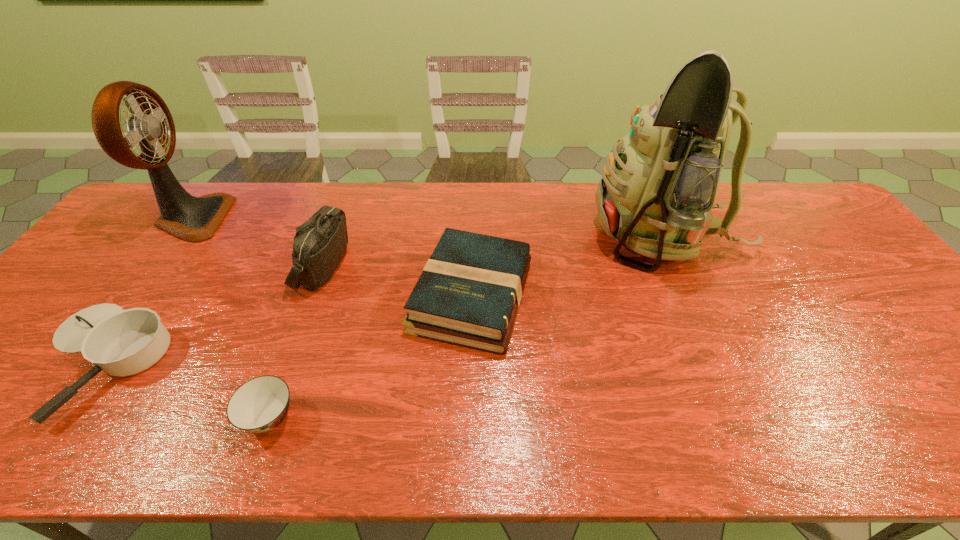
Where is `free region at the near edge of the desktop`? Image resolution: width=960 pixels, height=540 pixels. free region at the near edge of the desktop is located at coordinates (797, 429).

I want to click on vacant space at the left edge of the desktop, so (x=108, y=245).

Locate an element on the screen. This screenshot has width=960, height=540. vacant space at the right edge of the desktop is located at coordinates (843, 288).

Find the location of a particular element. free area in between the soup bowl and the shoulder bag is located at coordinates (297, 341).

Where is `free space that is in between the fifth shortest object and the shoulder bag`? The height and width of the screenshot is (540, 960). free space that is in between the fifth shortest object and the shoulder bag is located at coordinates (258, 241).

The width and height of the screenshot is (960, 540). I want to click on vacant area that lies between the second object from right to left and the soup bowl, so click(x=371, y=356).

This screenshot has width=960, height=540. I want to click on empty space that is in between the shoulder bag and the second tallest object, so pyautogui.click(x=258, y=241).

Where is `vacant area that lies between the fan and the soup bowl`? The height and width of the screenshot is (540, 960). vacant area that lies between the fan and the soup bowl is located at coordinates (231, 318).

The image size is (960, 540). In order to click on unoccupied position between the shoulder bag and the fifth shortest object in this screenshot , I will do `click(258, 241)`.

Point out which object is positioned as the third nearest to the soup bowl. Please provide its 2D coordinates. Your answer should be formatted as a tuple, i.e. [(x, y)], where the tuple contains the x and y coordinates of a point satisfying the conditions above.

[(320, 243)]